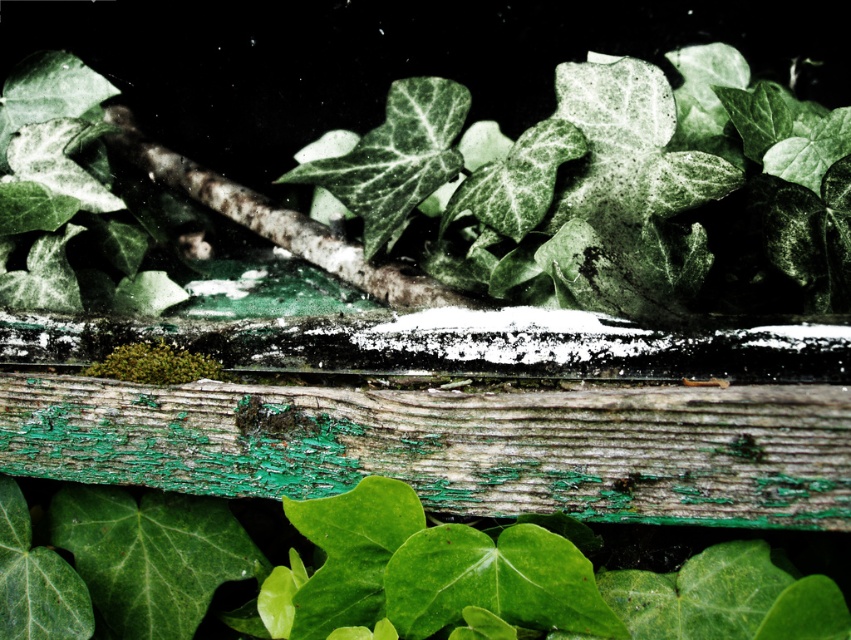
You are an artist observing the scene. You need to paint a picture where the peeling green paint wood plank at center and the green matte leaves at center are both included. Which object should you paint first if you want to depict depth by layering the taller object behind the shorter one?

The peeling green paint wood plank at center is not as tall as the green matte leaves at center, so you should paint the green matte leaves at center first as they are taller and need to be placed behind.

You are an artist planning to paint a scene similar to the one shown. You have a canvas that is 10 inches wide. The peeling green paint wood plank at center and green matte leaves at center are both in the center of your painting. If you want to fit both elements side by side horizontally, will they fit within the 10 inch width?

The peeling green paint wood plank at center is wider than the green matte leaves at center. To determine if they fit, add their widths. However, since the exact widths aren not provided, but the plank is wider, if the combined width exceeds 10 inches, they wonnt fit. Without specific measurements, it cannot be confirmed.

Looking at the scene with the peeling green paint wood plank at center and green matte leaves at center, which object is positioned to the right?

The green matte leaves at center are to the right of the peeling green paint wood plank at center.